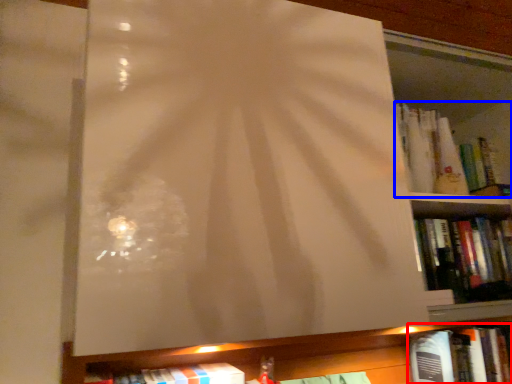
Question: Which object is closer to the camera taking this photo, book (highlighted by a red box) or book (highlighted by a blue box)?

Choices:
 (A) book
 (B) book

Answer: (B)